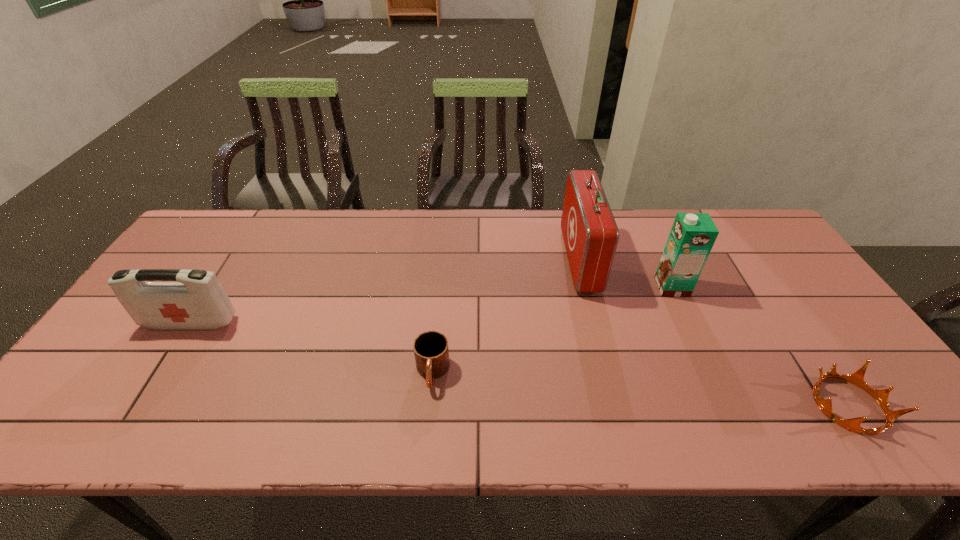
Where is `free spot that satisfies the following two spatial constraints: 1. on the side of the third object from left to right with the first aid cross symbol; 2. on the side of the mug with the handle`? free spot that satisfies the following two spatial constraints: 1. on the side of the third object from left to right with the first aid cross symbol; 2. on the side of the mug with the handle is located at coordinates (609, 373).

At what (x,y) coordinates should I click in order to perform the action: click on blank area in the image that satisfies the following two spatial constraints: 1. on the side of the mug with the handle; 2. on the right side of the crown. Please return your answer as a coordinate pair (x, y). Looking at the image, I should click on (429, 405).